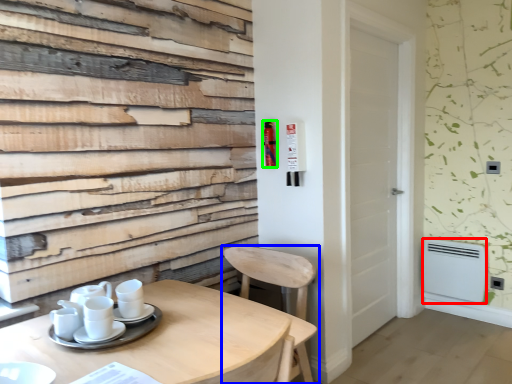
Question: Estimate the real-world distances between objects in this image. Which object is closer to appliance (highlighted by a red box), chair (highlighted by a blue box) or extinguisher (highlighted by a green box)?

Choices:
 (A) chair
 (B) extinguisher

Answer: (A)